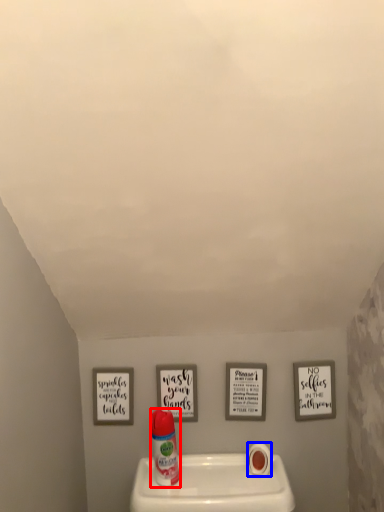
Question: Which object appears closest to the camera in this image, cleaning product (highlighted by a red box) or toilet paper (highlighted by a blue box)?

Choices:
 (A) cleaning product
 (B) toilet paper

Answer: (A)